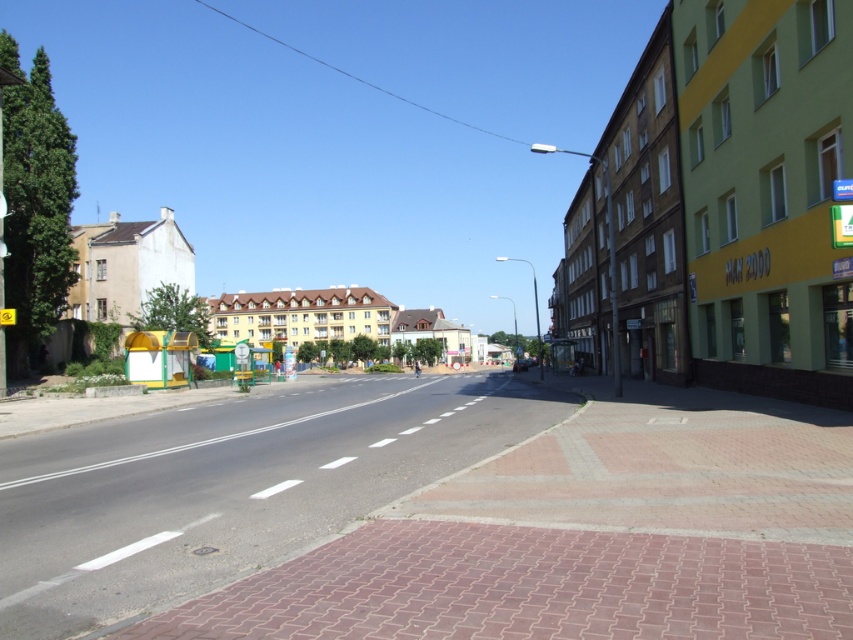
You are a delivery person trying to decide which building to deliver a package to first. The green painted building at right and the beige concrete building at left are both on your route. Which building is shorter?

The green painted building at right is shorter than the beige concrete building at left.

You are a delivery driver who needs to park your truck between the green painted building at right and the beige concrete building at left. Given that your truck is 2 meters wide, can you fit it in the space between them?

The green painted building at right is thinner than the beige concrete building at left, but without knowing the exact distance between them, it is impossible to determine if the truck will fit. Please check the actual space available.

Looking at this image, you are standing at the pedestrian area in the street scene. You see two points marked on the road ahead. The first point is at coordinate point[849,342] and the second is at point[363,310]. If you were to walk towards both points, which point would you reach first?

Point[849,342] is in front of point[363,310], so you would reach point[849,342] first.